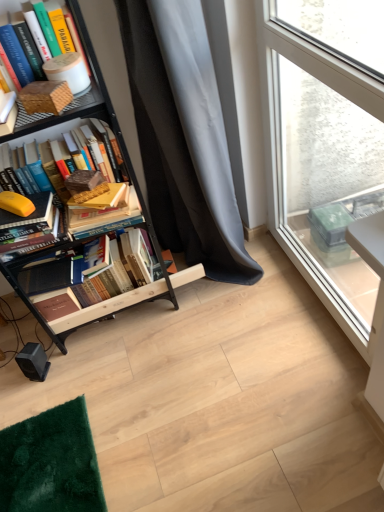
Measure the distance between point (x=160, y=259) and camera.

Point (x=160, y=259) and camera are 1.79 meters apart from each other.

Image resolution: width=384 pixels, height=512 pixels. Describe the element at coordinates (45, 97) in the screenshot. I see `brown matte paper at left` at that location.

What is the approximate width of hardcover book at left, marked as the 4th book in a bottom-to-top arrangement?

17.76 centimeters.

You are a GUI agent. You are given a task and a screenshot of the screen. Output one action in this format:
    pyautogui.click(x=<x>, y=<y>)
    Task: Click on the hardcover books at left, which appears as the 5th book when viewed from the top
    
    Given the screenshot: What is the action you would take?
    pyautogui.click(x=75, y=290)

This screenshot has height=512, width=384. Identify the location of matte brown book at upper left, which is the first book in top-to-bottom order. (43, 118).

Considering the sizes of brown matte paper at left and matte orange book at left, which appears as the 2th book when ordered from the bottom, in the image, is brown matte paper at left bigger or smaller than matte orange book at left, which appears as the 2th book when ordered from the bottom,?

In the image, brown matte paper at left appears to be smaller than matte orange book at left, which appears as the 2th book when ordered from the bottom.

How different are the orientations of brown matte paper at left and matte orange book at left, which appears as the 2th book when ordered from the bottom, in degrees?

30.6 degrees separate the facing orientations of brown matte paper at left and matte orange book at left, which appears as the 2th book when ordered from the bottom.

At what (x,y) coordinates should I click in order to perform the action: click on the 3rd book positioned below the brown matte paper at left (from a real-world perspective). Please return your answer as a coordinate pair (x, y). The height and width of the screenshot is (512, 384). Looking at the image, I should click on (34, 236).

Would you consider hardcover book at left, marked as the 4th book in a bottom-to-top arrangement, to be distant from gray fabric curtain at center?

hardcover book at left, marked as the 4th book in a bottom-to-top arrangement, is near gray fabric curtain at center, not far away.

Does point (66, 198) lie behind point (147, 154)?

No, it is in front of (147, 154).

From the image's perspective, is hardcover book at left, marked as the 4th book in a bottom-to-top arrangement, below gray fabric curtain at center?

Yes.

Who is shorter, hardcover book at left, the second book positioned from the top, or gray fabric curtain at center?

hardcover book at left, the second book positioned from the top, is shorter.

Is hardcover book at left, marked as the 4th book in a bottom-to-top arrangement, situated inside hardcover books at left, which appears as the 5th book when viewed from the top, or outside?

hardcover book at left, marked as the 4th book in a bottom-to-top arrangement, lies outside hardcover books at left, which appears as the 5th book when viewed from the top.

From the image's perspective, would you say hardcover book at left, the second book positioned from the top, is shown under hardcover books at left, which appears as the 5th book when viewed from the top?

Actually, hardcover book at left, the second book positioned from the top, appears above hardcover books at left, which appears as the 5th book when viewed from the top, in the image.

Considering the points (54, 132) and (63, 309), which point is in front, point (54, 132) or point (63, 309)?

Positioned in front is point (54, 132).

Does hardcover book at left, the second book positioned from the top, have a smaller size compared to hardcover books at left, which appears as the 5th book when viewed from the top?

Yes, hardcover book at left, the second book positioned from the top, is smaller than hardcover books at left, which appears as the 5th book when viewed from the top.

Is point (64, 291) farther from camera compared to point (7, 220)?

Yes, it is behind point (7, 220).

Can you confirm if hardcover books at left, the first book ordered from the bottom, is positioned to the left of orange matte banana at lower left, acting as the 3th book starting from the bottom?

No, hardcover books at left, the first book ordered from the bottom, is not to the left of orange matte banana at lower left, acting as the 3th book starting from the bottom.

Could you tell me if hardcover books at left, the first book ordered from the bottom, is turned towards orange matte banana at lower left, placed as the third book when sorted from top to bottom?

No.

Can you tell me how much hardcover books at left, the first book ordered from the bottom, and orange matte banana at lower left, placed as the third book when sorted from top to bottom, differ in facing direction?

They differ by 51.9 degrees in their facing directions.

Is black metal bookcase at left taller than matte orange book at left, which appears as the 2th book when ordered from the bottom?

Yes, black metal bookcase at left is taller than matte orange book at left, which appears as the 2th book when ordered from the bottom.

Is black metal bookcase at left smaller than matte orange book at left, which appears as the 2th book when ordered from the bottom?

No, black metal bookcase at left is not smaller than matte orange book at left, which appears as the 2th book when ordered from the bottom.

In the scene shown: Is black metal bookcase at left touching matte orange book at left, which appears as the 2th book when ordered from the bottom?

No, black metal bookcase at left is not with matte orange book at left, which appears as the 2th book when ordered from the bottom.

What's the angular difference between black metal bookcase at left and matte orange book at left, the fourth book from the top,'s facing directions?

9.33 degrees separate the facing orientations of black metal bookcase at left and matte orange book at left, the fourth book from the top.

Based on their sizes in the image, would you say brown matte paper at left is bigger or smaller than matte brown book at upper left, which ranks as the fifth book in bottom-to-top order?

In the image, brown matte paper at left appears to be smaller than matte brown book at upper left, which ranks as the fifth book in bottom-to-top order.

From the picture: Does brown matte paper at left have a greater width compared to matte brown book at upper left, which ranks as the fifth book in bottom-to-top order?

No.

Is brown matte paper at left touching matte brown book at upper left, which ranks as the fifth book in bottom-to-top order?

Yes, brown matte paper at left and matte brown book at upper left, which ranks as the fifth book in bottom-to-top order, clearly make contact.

Looking at this image, how many degrees apart are the facing directions of black metal bookcase at left and transparent glass window at upper right?

The angular difference between black metal bookcase at left and transparent glass window at upper right is 91.4 degrees.

Which is behind, black metal bookcase at left or transparent glass window at upper right?

black metal bookcase at left.

In the scene shown: Is black metal bookcase at left facing towards transparent glass window at upper right?

No, black metal bookcase at left is not oriented towards transparent glass window at upper right.

Does black metal bookcase at left have a greater height compared to transparent glass window at upper right?

Indeed, black metal bookcase at left has a greater height compared to transparent glass window at upper right.

The height and width of the screenshot is (512, 384). In order to click on paperback book on the right of matte orange book at left, the fourth book from the top in this screenshot , I will do `click(45, 97)`.

In order to click on curtain above the hardcover book at left, the second book positioned from the top (from the image's perspective) in this screenshot , I will do `click(183, 136)`.

Considering their positions, is brown matte paper at left positioned further to orange matte banana at lower left, placed as the third book when sorted from top to bottom, than matte orange book at left, which appears as the 2th book when ordered from the bottom?

Based on the image, brown matte paper at left appears to be further to orange matte banana at lower left, placed as the third book when sorted from top to bottom.

When comparing their distances from matte orange book at left, which appears as the 2th book when ordered from the bottom, does hardcover book at left, the second book positioned from the top, or brown matte paper at left seem further?

Based on the image, brown matte paper at left appears to be further to matte orange book at left, which appears as the 2th book when ordered from the bottom.

Looking at the image, which one is located closer to matte orange book at left, which appears as the 2th book when ordered from the bottom, matte brown book at upper left, which is the first book in top-to-bottom order, or transparent glass window at upper right?

matte brown book at upper left, which is the first book in top-to-bottom order.

Based on their spatial positions, is transparent glass window at upper right or brown matte paper at left closer to hardcover book at left, marked as the 4th book in a bottom-to-top arrangement?

Among the two, brown matte paper at left is located nearer to hardcover book at left, marked as the 4th book in a bottom-to-top arrangement.

When comparing their distances from gray fabric curtain at center, does matte orange book at left, the fourth book from the top, or orange matte banana at lower left, placed as the third book when sorted from top to bottom, seem closer?

The object closer to gray fabric curtain at center is matte orange book at left, the fourth book from the top.

Looking at the image, which one is located closer to matte brown book at upper left, which ranks as the fifth book in bottom-to-top order, gray fabric curtain at center or black metal bookcase at left?

black metal bookcase at left is positioned closer to the anchor matte brown book at upper left, which ranks as the fifth book in bottom-to-top order.

Considering their positions, is matte orange book at left, the fourth book from the top, positioned closer to gray fabric curtain at center than hardcover books at left, the first book ordered from the bottom?

The object closer to gray fabric curtain at center is hardcover books at left, the first book ordered from the bottom.

From the picture: From the image, which object appears to be nearer to matte brown book at upper left, which ranks as the fifth book in bottom-to-top order, orange matte banana at lower left, acting as the 3th book starting from the bottom, or transparent glass window at upper right?

The object closer to matte brown book at upper left, which ranks as the fifth book in bottom-to-top order, is orange matte banana at lower left, acting as the 3th book starting from the bottom.

Where is `paperback book situated between black metal bookcase at left and transparent glass window at upper right from left to right`? Image resolution: width=384 pixels, height=512 pixels. paperback book situated between black metal bookcase at left and transparent glass window at upper right from left to right is located at coordinates (45, 97).

This screenshot has height=512, width=384. I want to click on bookcase between orange matte banana at lower left, placed as the third book when sorted from top to bottom, and gray fabric curtain at center from left to right, so click(105, 301).

Identify the location of curtain between black metal bookcase at left and transparent glass window at upper right from left to right. (183, 136).

Locate an element on the screen. The width and height of the screenshot is (384, 512). bookcase between hardcover book at left, the second book positioned from the top, and gray fabric curtain at center is located at coordinates (105, 301).